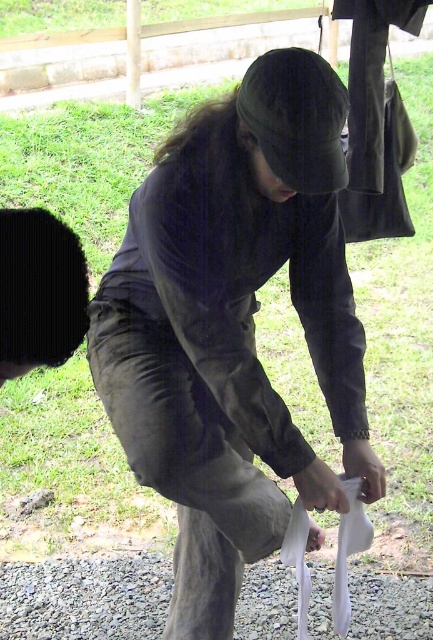
Can you confirm if dark gray fabric at center is positioned above gray gravel at lower center?

Correct, dark gray fabric at center is located above gray gravel at lower center.

Which is in front, point (93, 323) or point (74, 621)?

Point (93, 323)

At what (x,y) coordinates should I click in order to perform the action: click on dark gray fabric at center. Please return your answer as a coordinate pair (x, y). Looking at the image, I should click on (232, 326).